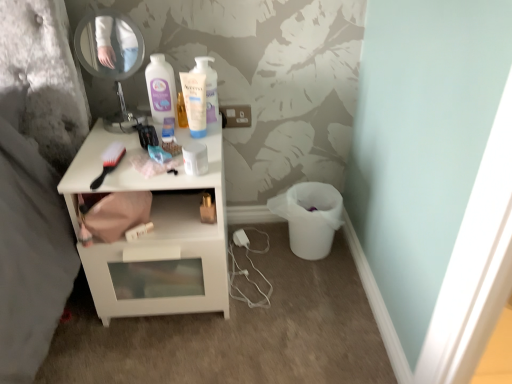
Find the location of a particular element. The width and height of the screenshot is (512, 384). vacant area that lies in front of metallic round mirror at upper left is located at coordinates (110, 147).